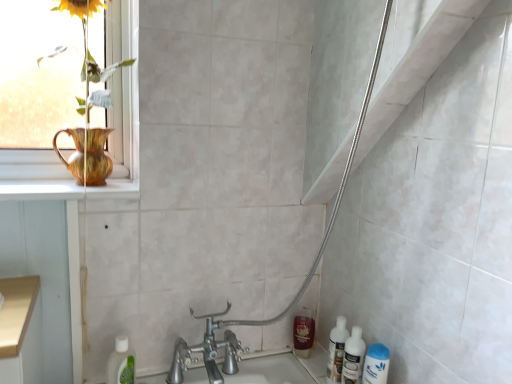
Measure the distance between point (294, 323) and camera.

The distance of point (294, 323) from camera is 4.86 feet.

I want to click on white glossy bottles at lower right, which is the second cleaning product from left to right, so click(353, 357).

This screenshot has height=384, width=512. Describe the element at coordinates (336, 351) in the screenshot. I see `translucent plastic bottles at lower right` at that location.

This screenshot has height=384, width=512. Describe the element at coordinates (124, 133) in the screenshot. I see `matte gold vase at upper left` at that location.

Describe the element at coordinates (121, 363) in the screenshot. I see `clear plastic bottle at lower left, positioned as the second cleaning product in right-to-left order` at that location.

At what (x,y) coordinates should I click in order to perform the action: click on shiny brown bottle at lower right, which is counted as the 2th mouthwash, starting from the right. Please return your answer as a coordinate pair (x, y). The image size is (512, 384). Looking at the image, I should click on (303, 332).

Consider the image. In terms of height, does clear plastic bottle at lower left, positioned as the second cleaning product in right-to-left order, look taller or shorter compared to shiny brown bottle at lower right, the second mouthwash when ordered from front to back?

clear plastic bottle at lower left, positioned as the second cleaning product in right-to-left order, is taller than shiny brown bottle at lower right, the second mouthwash when ordered from front to back.

How different are the orientations of clear plastic bottle at lower left, positioned as the second cleaning product in right-to-left order, and shiny brown bottle at lower right, the second mouthwash when ordered from front to back, in degrees?

There is a 65.9-degree angle between the facing directions of clear plastic bottle at lower left, positioned as the second cleaning product in right-to-left order, and shiny brown bottle at lower right, the second mouthwash when ordered from front to back.

Could you tell me if clear plastic bottle at lower left, marked as the 1th cleaning product in a left-to-right arrangement, is turned towards shiny brown bottle at lower right, the 1th mouthwash from the back?

No.

From the image's perspective, relative to shiny brown bottle at lower right, which is counted as the first mouthwash, starting from the left, is clear plastic bottle at lower left, positioned as the second cleaning product in right-to-left order, above or below?

clear plastic bottle at lower left, positioned as the second cleaning product in right-to-left order, is below shiny brown bottle at lower right, which is counted as the first mouthwash, starting from the left.

From the image's perspective, is translucent plastic bottles at lower right under shiny brown bottle at lower right, the 1th mouthwash from the back?

Actually, translucent plastic bottles at lower right appears above shiny brown bottle at lower right, the 1th mouthwash from the back, in the image.

This screenshot has height=384, width=512. I want to click on bottle in front of the shiny brown bottle at lower right, the 1th mouthwash from the back, so 336,351.

Could you tell me if translucent plastic bottles at lower right is turned towards shiny brown bottle at lower right, which is counted as the first mouthwash, starting from the left?

No, translucent plastic bottles at lower right is not turned towards shiny brown bottle at lower right, which is counted as the first mouthwash, starting from the left.

In the image, is translucent plastic bottles at lower right positioned in front of or behind shiny brown bottle at lower right, the 1th mouthwash from the back?

Visually, translucent plastic bottles at lower right is located in front of shiny brown bottle at lower right, the 1th mouthwash from the back.

Is translucent plastic bottles at lower right further to the viewer compared to clear plastic bottle at lower left, positioned as the second cleaning product in right-to-left order?

That is True.

Which object is thinner, translucent plastic bottles at lower right or clear plastic bottle at lower left, positioned as the second cleaning product in right-to-left order?

Thinner between the two is clear plastic bottle at lower left, positioned as the second cleaning product in right-to-left order.

Is translucent plastic bottles at lower right positioned with its back to clear plastic bottle at lower left, marked as the 1th cleaning product in a left-to-right arrangement?

No, translucent plastic bottles at lower right's orientation is not away from clear plastic bottle at lower left, marked as the 1th cleaning product in a left-to-right arrangement.

Considering the relative sizes of translucent plastic bottles at lower right and clear plastic bottle at lower left, marked as the 1th cleaning product in a left-to-right arrangement, in the image provided, is translucent plastic bottles at lower right bigger than clear plastic bottle at lower left, marked as the 1th cleaning product in a left-to-right arrangement,?

Correct, translucent plastic bottles at lower right is larger in size than clear plastic bottle at lower left, marked as the 1th cleaning product in a left-to-right arrangement.

Looking at this image, can we say clear plastic bottle at lower left, positioned as the second cleaning product in right-to-left order, lies outside white glossy mouthwash at lower right, arranged as the 2th mouthwash when viewed from the left?

Yes, clear plastic bottle at lower left, positioned as the second cleaning product in right-to-left order, is outside of white glossy mouthwash at lower right, arranged as the 2th mouthwash when viewed from the left.

From a real-world perspective, is clear plastic bottle at lower left, positioned as the second cleaning product in right-to-left order, positioned above or below white glossy mouthwash at lower right, arranged as the 2th mouthwash when viewed from the left?

Clearly, from a real-world perspective, clear plastic bottle at lower left, positioned as the second cleaning product in right-to-left order, is below white glossy mouthwash at lower right, arranged as the 2th mouthwash when viewed from the left.

From the image's perspective, is clear plastic bottle at lower left, marked as the 1th cleaning product in a left-to-right arrangement, located above white glossy mouthwash at lower right, the 2th mouthwash viewed from the back?

Correct, clear plastic bottle at lower left, marked as the 1th cleaning product in a left-to-right arrangement, appears higher than white glossy mouthwash at lower right, the 2th mouthwash viewed from the back, in the image.

Is clear plastic bottle at lower left, marked as the 1th cleaning product in a left-to-right arrangement, oriented away from white glossy mouthwash at lower right, which is counted as the 1th mouthwash, starting from the front?

clear plastic bottle at lower left, marked as the 1th cleaning product in a left-to-right arrangement, does not have its back to white glossy mouthwash at lower right, which is counted as the 1th mouthwash, starting from the front.

Based on the photo, which object is positioned more to the left, white glossy mouthwash at lower right, arranged as the 2th mouthwash when viewed from the left, or translucent plastic bottles at lower right?

translucent plastic bottles at lower right.

Consider the image. How far apart are white glossy mouthwash at lower right, which is counted as the 1th mouthwash, starting from the front, and translucent plastic bottles at lower right?

A distance of 5.83 inches exists between white glossy mouthwash at lower right, which is counted as the 1th mouthwash, starting from the front, and translucent plastic bottles at lower right.

Is white glossy mouthwash at lower right, the 2th mouthwash viewed from the back, bigger than translucent plastic bottles at lower right?

Incorrect, white glossy mouthwash at lower right, the 2th mouthwash viewed from the back, is not larger than translucent plastic bottles at lower right.

This screenshot has height=384, width=512. Find the location of `bottle below the white glossy bottles at lower right, which is the second cleaning product from left to right (from a real-world perspective)`. bottle below the white glossy bottles at lower right, which is the second cleaning product from left to right (from a real-world perspective) is located at coordinates (336, 351).

Which object is further away from the camera, translucent plastic bottles at lower right or white glossy bottles at lower right, which is the second cleaning product from left to right?

translucent plastic bottles at lower right is further away from the camera.

Can we say translucent plastic bottles at lower right lies outside white glossy bottles at lower right, which is the second cleaning product from left to right?

Absolutely, translucent plastic bottles at lower right is external to white glossy bottles at lower right, which is the second cleaning product from left to right.

From a real-world perspective, which is physically above, shiny brown bottle at lower right, which is counted as the first mouthwash, starting from the left, or white glossy bottles at lower right, marked as the first cleaning product in a right-to-left arrangement?

white glossy bottles at lower right, marked as the first cleaning product in a right-to-left arrangement.

Locate an element on the screen. The width and height of the screenshot is (512, 384). mouthwash above the white glossy bottles at lower right, marked as the first cleaning product in a right-to-left arrangement (from the image's perspective) is located at coordinates (303, 332).

Find the location of `mouthwash that appears behind the clear plastic bottle at lower left, marked as the 1th cleaning product in a left-to-right arrangement`. mouthwash that appears behind the clear plastic bottle at lower left, marked as the 1th cleaning product in a left-to-right arrangement is located at coordinates (303, 332).

From the image's perspective, count 1st mouthwashs downward from the translucent plastic bottles at lower right and point to it. Please provide its 2D coordinates.

[(303, 332)]

Which object lies further to the anchor point clear plastic bottle at lower left, marked as the 1th cleaning product in a left-to-right arrangement, translucent plastic bottles at lower right or white glossy mouthwash at lower right, the 2th mouthwash viewed from the back?

Among the two, white glossy mouthwash at lower right, the 2th mouthwash viewed from the back, is located further to clear plastic bottle at lower left, marked as the 1th cleaning product in a left-to-right arrangement.

Based on the photo, considering their positions, is clear plastic bottle at lower left, positioned as the second cleaning product in right-to-left order, positioned closer to shiny brown bottle at lower right, which is counted as the 2th mouthwash, starting from the right, than matte gold vase at upper left?

clear plastic bottle at lower left, positioned as the second cleaning product in right-to-left order, is closer to shiny brown bottle at lower right, which is counted as the 2th mouthwash, starting from the right.

Based on their spatial positions, is clear plastic bottle at lower left, marked as the 1th cleaning product in a left-to-right arrangement, or white glossy bottles at lower right, which is the second cleaning product from left to right, further from shiny brown bottle at lower right, which is counted as the first mouthwash, starting from the left?

clear plastic bottle at lower left, marked as the 1th cleaning product in a left-to-right arrangement, is further to shiny brown bottle at lower right, which is counted as the first mouthwash, starting from the left.

When comparing their distances from translucent plastic bottles at lower right, does white glossy bottles at lower right, marked as the first cleaning product in a right-to-left arrangement, or shiny brown bottle at lower right, the second mouthwash when ordered from front to back, seem closer?

Among the two, white glossy bottles at lower right, marked as the first cleaning product in a right-to-left arrangement, is located nearer to translucent plastic bottles at lower right.

In the scene shown: Based on their spatial positions, is clear plastic bottle at lower left, marked as the 1th cleaning product in a left-to-right arrangement, or white glossy mouthwash at lower right, which is counted as the 1th mouthwash, starting from the front, further from shiny brown bottle at lower right, which is counted as the 2th mouthwash, starting from the right?

clear plastic bottle at lower left, marked as the 1th cleaning product in a left-to-right arrangement, lies further to shiny brown bottle at lower right, which is counted as the 2th mouthwash, starting from the right, than the other object.

Looking at the image, which one is located closer to white glossy mouthwash at lower right, which is counted as the 1th mouthwash, starting from the front, clear plastic bottle at lower left, positioned as the second cleaning product in right-to-left order, or white glossy bottles at lower right, marked as the first cleaning product in a right-to-left arrangement?

Among the two, white glossy bottles at lower right, marked as the first cleaning product in a right-to-left arrangement, is located nearer to white glossy mouthwash at lower right, which is counted as the 1th mouthwash, starting from the front.

Considering their positions, is translucent plastic bottles at lower right positioned further to shiny brown bottle at lower right, the 1th mouthwash from the back, than matte gold vase at upper left?

Based on the image, matte gold vase at upper left appears to be further to shiny brown bottle at lower right, the 1th mouthwash from the back.

Estimate the real-world distances between objects in this image. Which object is closer to matte gold vase at upper left, white glossy mouthwash at lower right, arranged as the 2th mouthwash when viewed from the left, or white glossy bottles at lower right, marked as the first cleaning product in a right-to-left arrangement?

white glossy bottles at lower right, marked as the first cleaning product in a right-to-left arrangement.

The width and height of the screenshot is (512, 384). Identify the location of mouthwash between matte gold vase at upper left and white glossy mouthwash at lower right, the 2th mouthwash viewed from the back, in the up-down direction. (303, 332).

Find the location of a particular element. The width and height of the screenshot is (512, 384). bottle situated between clear plastic bottle at lower left, marked as the 1th cleaning product in a left-to-right arrangement, and white glossy mouthwash at lower right, which is counted as the 1th mouthwash, starting from the front, from left to right is located at coordinates (336, 351).

At what (x,y) coordinates should I click in order to perform the action: click on mouthwash between clear plastic bottle at lower left, positioned as the second cleaning product in right-to-left order, and white glossy bottles at lower right, marked as the first cleaning product in a right-to-left arrangement, in the horizontal direction. Please return your answer as a coordinate pair (x, y). The width and height of the screenshot is (512, 384). Looking at the image, I should click on (303, 332).

This screenshot has height=384, width=512. In order to click on mouthwash situated between clear plastic bottle at lower left, positioned as the second cleaning product in right-to-left order, and translucent plastic bottles at lower right from left to right in this screenshot , I will do `click(303, 332)`.